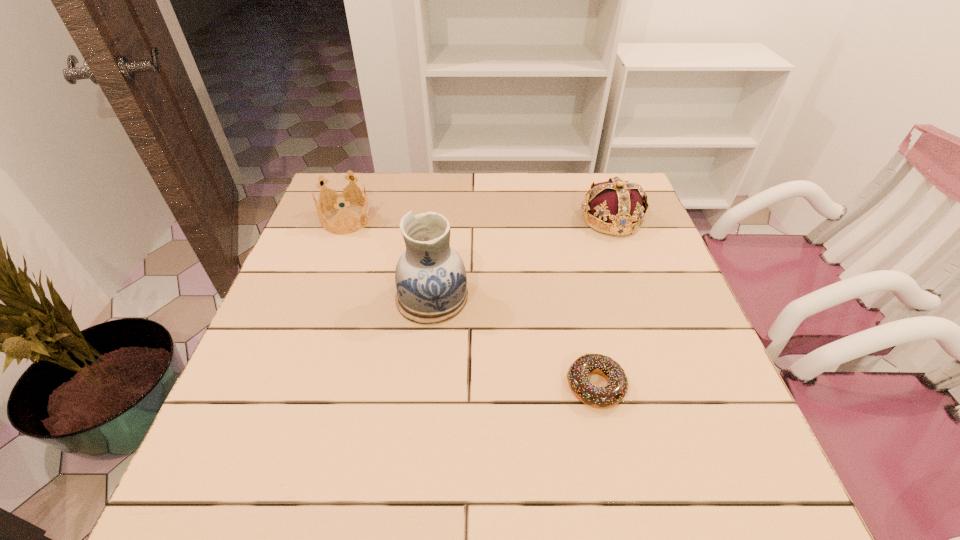
The height and width of the screenshot is (540, 960). Identify the location of vacant region located on the back of the doughnut. (584, 332).

Image resolution: width=960 pixels, height=540 pixels. I want to click on object present at the left edge, so click(x=340, y=197).

Where is `object that is at the right edge`? This screenshot has width=960, height=540. object that is at the right edge is located at coordinates (618, 203).

At what (x,y) coordinates should I click in order to perform the action: click on object that is at the far left corner. Please return your answer as a coordinate pair (x, y). Looking at the image, I should click on (340, 197).

Find the location of a particular element. Image resolution: width=960 pixels, height=540 pixels. object that is at the far right corner is located at coordinates (618, 203).

This screenshot has width=960, height=540. What are the coordinates of `free space at the far edge of the desktop` in the screenshot? It's located at (438, 202).

The image size is (960, 540). In the image, there is a desktop. In order to click on free region at the near edge in this screenshot , I will do `click(322, 457)`.

You are a GUI agent. You are given a task and a screenshot of the screen. Output one action in this format:
    pyautogui.click(x=<x>, y=<y>)
    Task: Click on the vacant space at the left edge
    This screenshot has width=960, height=540.
    Given the screenshot: What is the action you would take?
    pyautogui.click(x=310, y=416)

Locate an element on the screen. The image size is (960, 540). vacant space at the right edge of the desktop is located at coordinates (674, 352).

The width and height of the screenshot is (960, 540). Find the location of `free space at the near left corner`. free space at the near left corner is located at coordinates (286, 471).